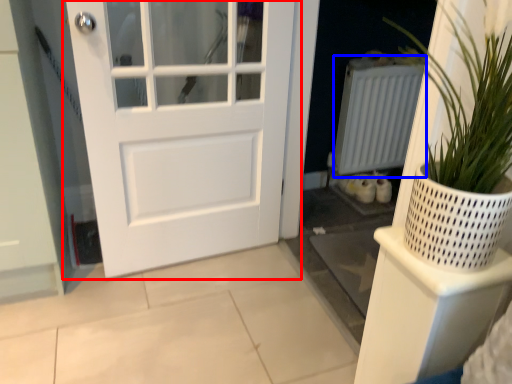
Question: Which object is further to the camera taking this photo, door (highlighted by a red box) or radiator (highlighted by a blue box)?

Choices:
 (A) door
 (B) radiator

Answer: (B)